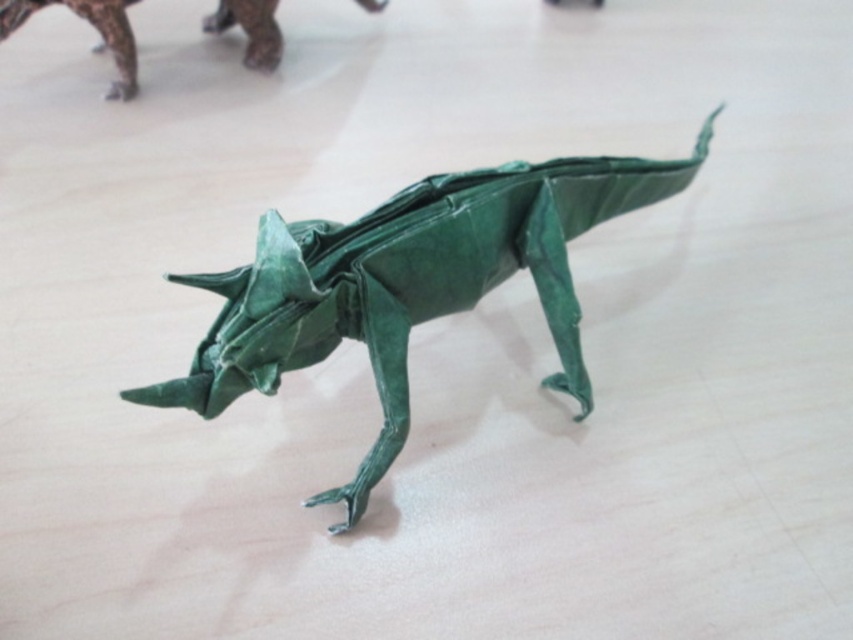
What do you see at coordinates (409, 284) in the screenshot? The height and width of the screenshot is (640, 853). I see `green paper origami dinosaur at center` at bounding box center [409, 284].

Does green paper origami dinosaur at center appear under green paper dinosaur at upper left?

Yes, green paper origami dinosaur at center is below green paper dinosaur at upper left.

Which is in front, point (285, 282) or point (376, 3)?

Positioned in front is point (285, 282).

This screenshot has width=853, height=640. I want to click on green paper origami dinosaur at center, so click(x=409, y=284).